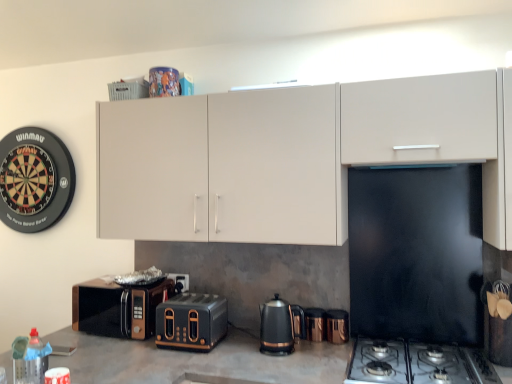
Question: Is copper metallic kettle at center, acting as the first appliance starting from the right, in front of or behind black metallic toaster at center in the image?

Choices:
 (A) behind
 (B) front

Answer: (A)

Question: Is copper metallic kettle at center, marked as the 2th appliance in a left-to-right arrangement, inside or outside of black metallic toaster at center?

Choices:
 (A) outside
 (B) inside

Answer: (A)

Question: Which object is positioned closest to the black metallic toaster at center?

Choices:
 (A) black metallic gas stove at lower right
 (B) black plastic dartboard at left
 (C) matte white cabinet at upper center
 (D) bronze metallic microwave at lower left
 (E) copper metallic kettle at center, marked as the 2th appliance in a left-to-right arrangement

Answer: (D)

Question: Which of these objects is positioned farthest from the metallic copper kettle at center, placed as the 2th appliance when sorted from right to left?

Choices:
 (A) black metallic gas stove at lower right
 (B) black plastic dartboard at left
 (C) black metallic toaster at center
 (D) matte white cabinet at upper center
 (E) black plastic kettle at center

Answer: (B)